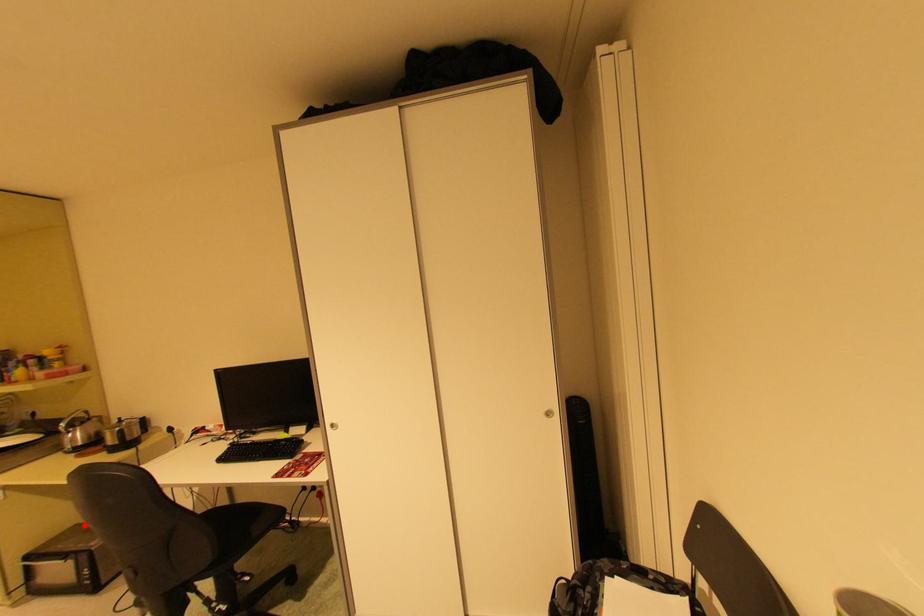
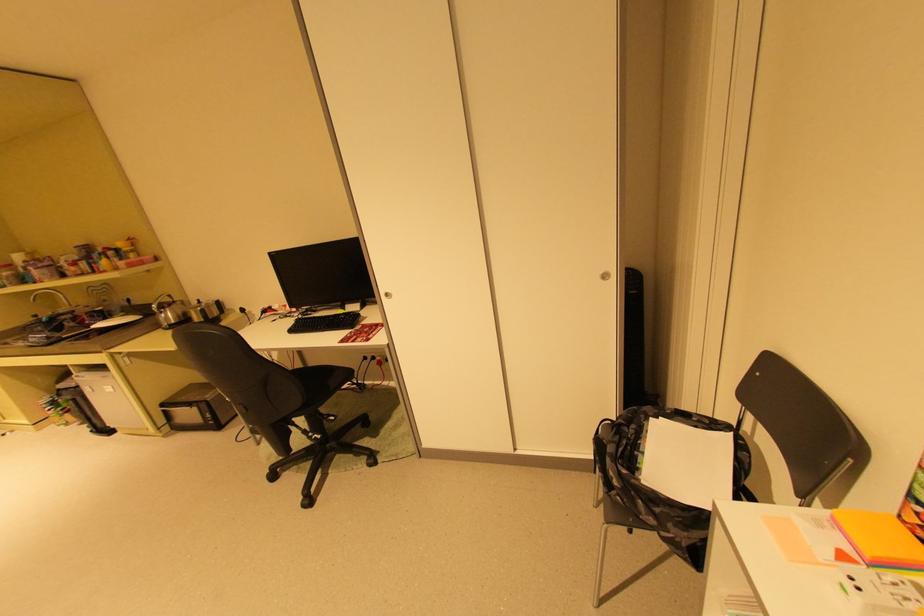
Question: I am providing you with two images of the same scene from different viewpoints. Image1 has a red point marked. In image2, the corresponding 3D location appears at what relative position? Reply with the corresponding letter.

Choices:
 (A) Closer
 (B) Farther

Answer: (B)